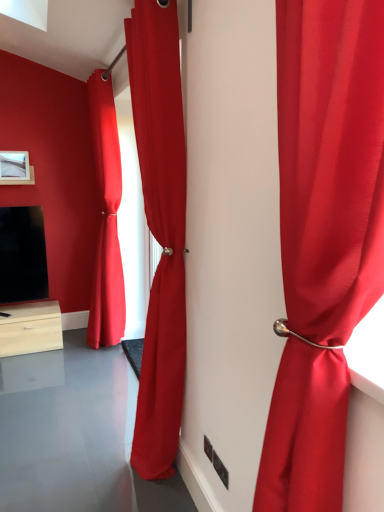
Describe the element at coordinates (106, 219) in the screenshot. The height and width of the screenshot is (512, 384). I see `satin red curtain at center, which is the first curtain from back to front` at that location.

From the picture: Measure the distance between satin red curtain at center, which is the first curtain from back to front, and camera.

satin red curtain at center, which is the first curtain from back to front, is 2.90 meters away from camera.

The height and width of the screenshot is (512, 384). Describe the element at coordinates (160, 230) in the screenshot. I see `satin red curtain at center, arranged as the 2th curtain when viewed from the left` at that location.

How much space does satin red curtain at right, placed as the first curtain when sorted from right to left, occupy vertically?

The height of satin red curtain at right, placed as the first curtain when sorted from right to left, is 1.43 meters.

Image resolution: width=384 pixels, height=512 pixels. Find the location of `satin red curtain at center, which appears as the 3th curtain when viewed from the right`. satin red curtain at center, which appears as the 3th curtain when viewed from the right is located at coordinates (106, 219).

From the picture: Is satin red curtain at center, which is counted as the third curtain, starting from the front, inside or outside of satin red curtain at right, which is counted as the 3th curtain, starting from the back?

satin red curtain at center, which is counted as the third curtain, starting from the front, exists outside the volume of satin red curtain at right, which is counted as the 3th curtain, starting from the back.

From a real-world perspective, who is located higher, satin red curtain at center, which appears as the 3th curtain when viewed from the right, or satin red curtain at right, which is the 1th curtain in front-to-back order?

satin red curtain at right, which is the 1th curtain in front-to-back order.

From the image's perspective, is satin red curtain at center, which is counted as the first curtain, starting from the left, on top of satin red curtain at right, placed as the first curtain when sorted from right to left?

Yes, from the image's perspective, satin red curtain at center, which is counted as the first curtain, starting from the left, is above satin red curtain at right, placed as the first curtain when sorted from right to left.

Is satin red curtain at center, which is counted as the first curtain, starting from the left, thinner than satin red curtain at right, the third curtain positioned from the left?

No.

Does satin red curtain at center, the 2th curtain positioned from the front, have a lesser height compared to satin red curtain at right, which is counted as the 3th curtain, starting from the back?

No.

From a real-world perspective, starting from the satin red curtain at center, the 2th curtain positioned from the front, which curtain is the 2nd one vertically above it? Please provide its 2D coordinates.

[(323, 237)]

Is the surface of satin red curtain at center, the 2th curtain positioned from the front, in direct contact with satin red curtain at right, the third curtain positioned from the left?

No, satin red curtain at center, the 2th curtain positioned from the front, is not touching satin red curtain at right, the third curtain positioned from the left.

Does point (155, 1) appear closer or farther from the camera than point (288, 155)?

Point (155, 1) is positioned farther from the camera compared to point (288, 155).

Is satin red curtain at center, which is counted as the first curtain, starting from the left, in front of or behind matte white picture frame at upper left in the image?

satin red curtain at center, which is counted as the first curtain, starting from the left, is positioned closer to the viewer than matte white picture frame at upper left.

Could you tell me if satin red curtain at center, which is counted as the third curtain, starting from the front, is turned towards matte white picture frame at upper left?

No, satin red curtain at center, which is counted as the third curtain, starting from the front, is not turned towards matte white picture frame at upper left.

Which of these two, satin red curtain at center, which is counted as the first curtain, starting from the left, or matte white picture frame at upper left, is bigger?

satin red curtain at center, which is counted as the first curtain, starting from the left, is bigger.

Where is `the 1st curtain to the right of the matte white picture frame at upper left, counting from the anchor's position`? Image resolution: width=384 pixels, height=512 pixels. the 1st curtain to the right of the matte white picture frame at upper left, counting from the anchor's position is located at coordinates (106, 219).

Is the surface of satin red curtain at center, which appears as the 3th curtain when viewed from the right, in direct contact with satin red curtain at center, arranged as the 2th curtain when viewed from the left?

satin red curtain at center, which appears as the 3th curtain when viewed from the right, is not next to satin red curtain at center, arranged as the 2th curtain when viewed from the left, and they're not touching.

Would you say satin red curtain at center, which is the first curtain from back to front, is inside or outside satin red curtain at center, the 2th curtain positioned from the front?

satin red curtain at center, which is the first curtain from back to front, exists outside the volume of satin red curtain at center, the 2th curtain positioned from the front.

What's the angular difference between satin red curtain at center, which is counted as the first curtain, starting from the left, and satin red curtain at center, the 2th curtain positioned from the front,'s facing directions?

The facing directions of satin red curtain at center, which is counted as the first curtain, starting from the left, and satin red curtain at center, the 2th curtain positioned from the front, are 0.00227 degrees apart.

From a real-world perspective, which object rests below the other?

satin red curtain at center, the 2th curtain positioned from the front, from a real-world perspective.

Measure the distance from satin red curtain at right, which is the 1th curtain in front-to-back order, to satin red curtain at center, which is counted as the first curtain, starting from the left.

satin red curtain at right, which is the 1th curtain in front-to-back order, and satin red curtain at center, which is counted as the first curtain, starting from the left, are 2.58 meters apart.

Considering the sizes of objects satin red curtain at right, which is counted as the 3th curtain, starting from the back, and satin red curtain at center, which appears as the 3th curtain when viewed from the right, in the image provided, who is wider, satin red curtain at right, which is counted as the 3th curtain, starting from the back, or satin red curtain at center, which appears as the 3th curtain when viewed from the right,?

Wider between the two is satin red curtain at center, which appears as the 3th curtain when viewed from the right.

Based on the photo, from a real-world perspective, which is physically below, satin red curtain at right, which is counted as the 3th curtain, starting from the back, or satin red curtain at center, which appears as the 3th curtain when viewed from the right?

In real-world perspective, satin red curtain at center, which appears as the 3th curtain when viewed from the right, is lower.

Is satin red curtain at right, placed as the first curtain when sorted from right to left, far away from satin red curtain at center, which is counted as the first curtain, starting from the left?

satin red curtain at right, placed as the first curtain when sorted from right to left, is positioned a significant distance from satin red curtain at center, which is counted as the first curtain, starting from the left.

From the image's perspective, is satin red curtain at center, which ranks as the 2th curtain in right-to-left order, under matte white picture frame at upper left?

Indeed, from the image's perspective, satin red curtain at center, which ranks as the 2th curtain in right-to-left order, is shown beneath matte white picture frame at upper left.

Which object is further away from the camera, satin red curtain at center, the 2th curtain viewed from the back, or matte white picture frame at upper left?

matte white picture frame at upper left is further away from the camera.

Considering the relative sizes of satin red curtain at center, arranged as the 2th curtain when viewed from the left, and matte white picture frame at upper left in the image provided, is satin red curtain at center, arranged as the 2th curtain when viewed from the left, bigger than matte white picture frame at upper left?

Indeed, satin red curtain at center, arranged as the 2th curtain when viewed from the left, has a larger size compared to matte white picture frame at upper left.

Which is further, (167, 437) or (25, 168)?

Point (25, 168)

How different are the orientations of matte white picture frame at upper left and satin red curtain at center, which is counted as the first curtain, starting from the left, in degrees?

There is a 88-degree angle between the facing directions of matte white picture frame at upper left and satin red curtain at center, which is counted as the first curtain, starting from the left.

From the image's perspective, which is above, matte white picture frame at upper left or satin red curtain at center, which is counted as the first curtain, starting from the left?

matte white picture frame at upper left is shown above in the image.

Considering the sizes of objects matte white picture frame at upper left and satin red curtain at center, which is the first curtain from back to front, in the image provided, who is shorter, matte white picture frame at upper left or satin red curtain at center, which is the first curtain from back to front,?

matte white picture frame at upper left is shorter.

Is matte white picture frame at upper left to the left or to the right of satin red curtain at center, which is counted as the third curtain, starting from the front, in the image?

From the image, it's evident that matte white picture frame at upper left is to the left of satin red curtain at center, which is counted as the third curtain, starting from the front.

From a real-world perspective, count 1st curtains downward from the satin red curtain at right, the third curtain positioned from the left, and point to it. Please provide its 2D coordinates.

[(106, 219)]

Find the location of a particular element. the 1st curtain above the satin red curtain at right, which is counted as the 3th curtain, starting from the back (from the image's perspective) is located at coordinates (160, 230).

Estimate the real-world distances between objects in this image. Which object is closer to satin red curtain at right, which is the 1th curtain in front-to-back order, satin red curtain at center, which ranks as the 2th curtain in right-to-left order, or satin red curtain at center, which is counted as the first curtain, starting from the left?

Based on the image, satin red curtain at center, which ranks as the 2th curtain in right-to-left order, appears to be nearer to satin red curtain at right, which is the 1th curtain in front-to-back order.

From the image, which object appears to be farther from satin red curtain at center, which is the first curtain from back to front, satin red curtain at right, the third curtain positioned from the left, or matte white picture frame at upper left?

Based on the image, satin red curtain at right, the third curtain positioned from the left, appears to be further to satin red curtain at center, which is the first curtain from back to front.

When comparing their distances from satin red curtain at center, arranged as the 2th curtain when viewed from the left, does satin red curtain at center, which is counted as the first curtain, starting from the left, or satin red curtain at right, placed as the first curtain when sorted from right to left, seem closer?

satin red curtain at right, placed as the first curtain when sorted from right to left, lies closer to satin red curtain at center, arranged as the 2th curtain when viewed from the left, than the other object.

Which object lies nearer to the anchor point matte white picture frame at upper left, satin red curtain at right, the third curtain positioned from the left, or satin red curtain at center, the 2th curtain positioned from the front?

satin red curtain at center, the 2th curtain positioned from the front.

Based on their spatial positions, is satin red curtain at center, the 2th curtain viewed from the back, or satin red curtain at center, which is counted as the first curtain, starting from the left, closer to matte white picture frame at upper left?

satin red curtain at center, which is counted as the first curtain, starting from the left.

Looking at the image, which one is located further to matte white picture frame at upper left, satin red curtain at center, which is counted as the first curtain, starting from the left, or satin red curtain at center, the 2th curtain viewed from the back?

satin red curtain at center, the 2th curtain viewed from the back, is further to matte white picture frame at upper left.

Looking at the image, which one is located closer to satin red curtain at right, which is counted as the 3th curtain, starting from the back, satin red curtain at center, arranged as the 2th curtain when viewed from the left, or matte white picture frame at upper left?

Based on the image, satin red curtain at center, arranged as the 2th curtain when viewed from the left, appears to be nearer to satin red curtain at right, which is counted as the 3th curtain, starting from the back.

Considering their positions, is satin red curtain at right, the third curtain positioned from the left, positioned closer to satin red curtain at center, the 2th curtain positioned from the front, than satin red curtain at center, which appears as the 3th curtain when viewed from the right?

satin red curtain at right, the third curtain positioned from the left, is positioned closer to the anchor satin red curtain at center, the 2th curtain positioned from the front.

Locate an element on the screen. The height and width of the screenshot is (512, 384). curtain positioned between satin red curtain at center, the 2th curtain positioned from the front, and matte white picture frame at upper left from near to far is located at coordinates (106, 219).

At what (x,y) coordinates should I click in order to perform the action: click on curtain located between satin red curtain at right, which is the 1th curtain in front-to-back order, and satin red curtain at center, which is the first curtain from back to front, in the depth direction. Please return your answer as a coordinate pair (x, y). The height and width of the screenshot is (512, 384). Looking at the image, I should click on (160, 230).